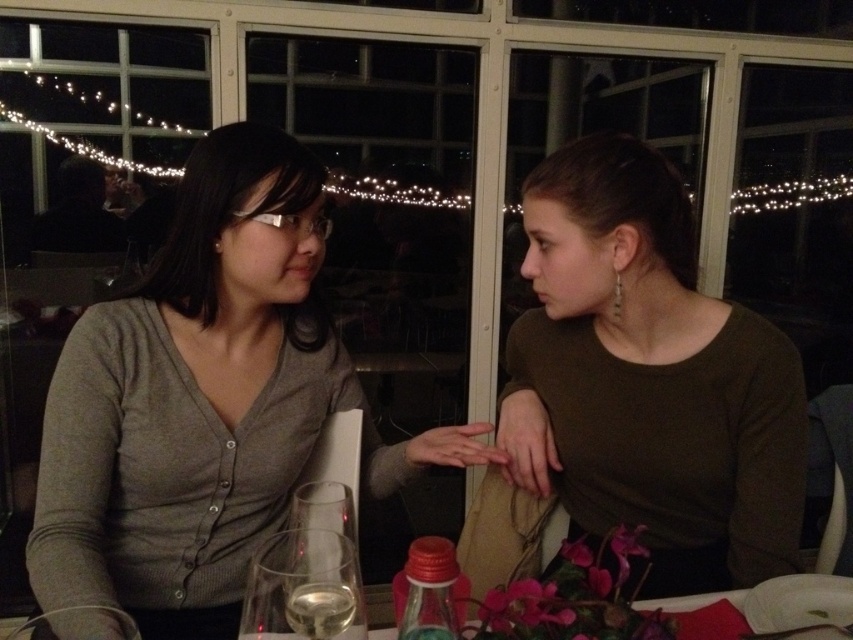
Question: Can you confirm if matte brown shirt at center is bigger than clear glass wine glass at lower left?

Choices:
 (A) yes
 (B) no

Answer: (A)

Question: Is matte gray cardigan at left above clear glass wine glass at lower left?

Choices:
 (A) no
 (B) yes

Answer: (B)

Question: Where is matte gray cardigan at left located in relation to matte brown shirt at center in the image?

Choices:
 (A) above
 (B) below

Answer: (B)

Question: Among these points, which one is nearest to the camera?

Choices:
 (A) (538, 388)
 (B) (289, 483)
 (C) (245, 627)

Answer: (C)

Question: Which object is closer to the camera taking this photo?

Choices:
 (A) matte brown shirt at center
 (B) matte gray cardigan at left
 (C) clear glass wine glass at lower left

Answer: (C)

Question: Which is nearer to the matte brown shirt at center?

Choices:
 (A) matte gray cardigan at left
 (B) clear glass wine glass at lower left

Answer: (A)